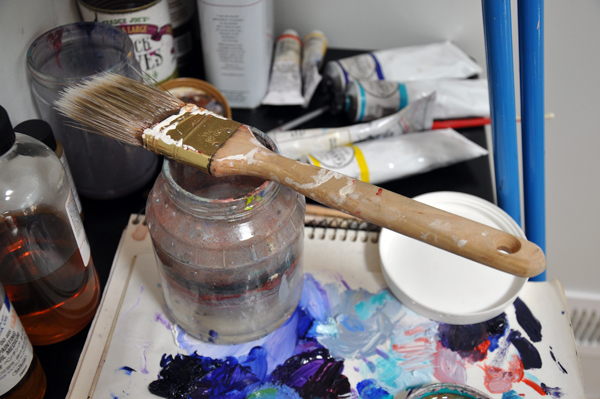
I want to click on white wall, so click(x=581, y=97).